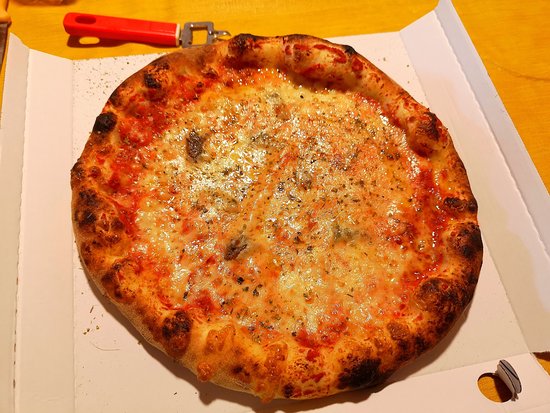
Where is `bottle opener handle`? This screenshot has height=413, width=550. bottle opener handle is located at coordinates (122, 26).